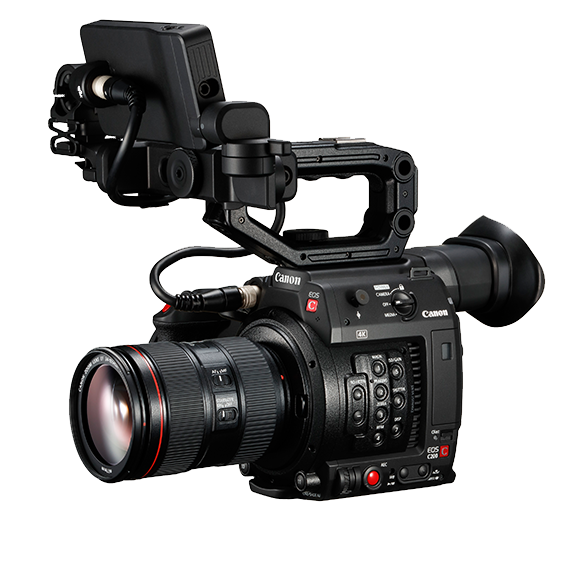
Locate an element on the screen. The image size is (580, 580). control switches is located at coordinates (221, 379), (226, 413).